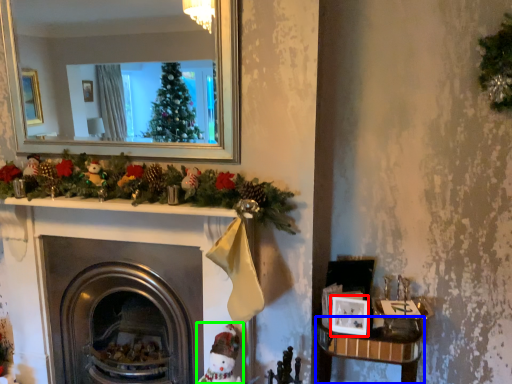
Question: Considering the real-world distances, which object is closest to picture frame (highlighted by a red box)? table (highlighted by a blue box) or toy (highlighted by a green box).

Choices:
 (A) table
 (B) toy

Answer: (A)